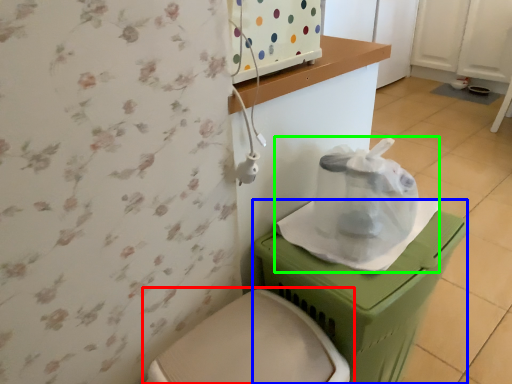
Question: Which object is positioned farthest from toilet (highlighted by a red box)? Select from potty (highlighted by a blue box) and paper bag (highlighted by a green box).

Choices:
 (A) potty
 (B) paper bag

Answer: (B)